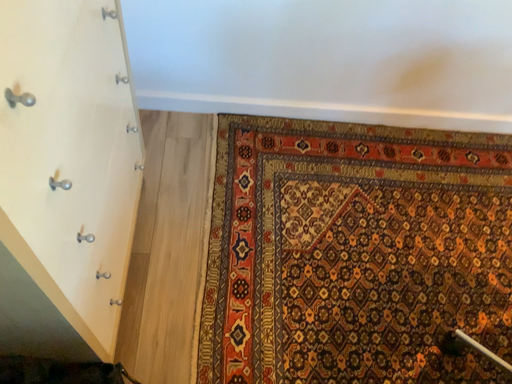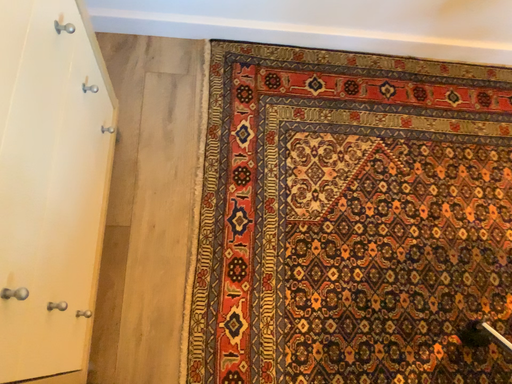
Question: How did the camera likely rotate when shooting the video?

Choices:
 (A) rotated downward
 (B) rotated upward

Answer: (A)